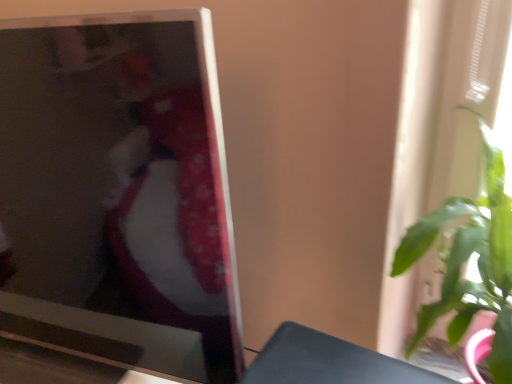
Question: In terms of height, does green leafy plant at right look taller or shorter compared to matte black television at left?

Choices:
 (A) short
 (B) tall

Answer: (A)

Question: Is green leafy plant at right wider or thinner than matte black television at left?

Choices:
 (A) thin
 (B) wide

Answer: (B)

Question: From the image's perspective, is green leafy plant at right located above or below matte black television at left?

Choices:
 (A) below
 (B) above

Answer: (A)

Question: In terms of size, does matte black television at left appear bigger or smaller than green leafy plant at right?

Choices:
 (A) big
 (B) small

Answer: (A)

Question: From a real-world perspective, is matte black television at left physically located above or below green leafy plant at right?

Choices:
 (A) below
 (B) above

Answer: (B)

Question: Based on their positions, is matte black television at left located to the left or right of green leafy plant at right?

Choices:
 (A) left
 (B) right

Answer: (A)

Question: Is point (114, 226) positioned closer to the camera than point (507, 327)?

Choices:
 (A) farther
 (B) closer

Answer: (A)